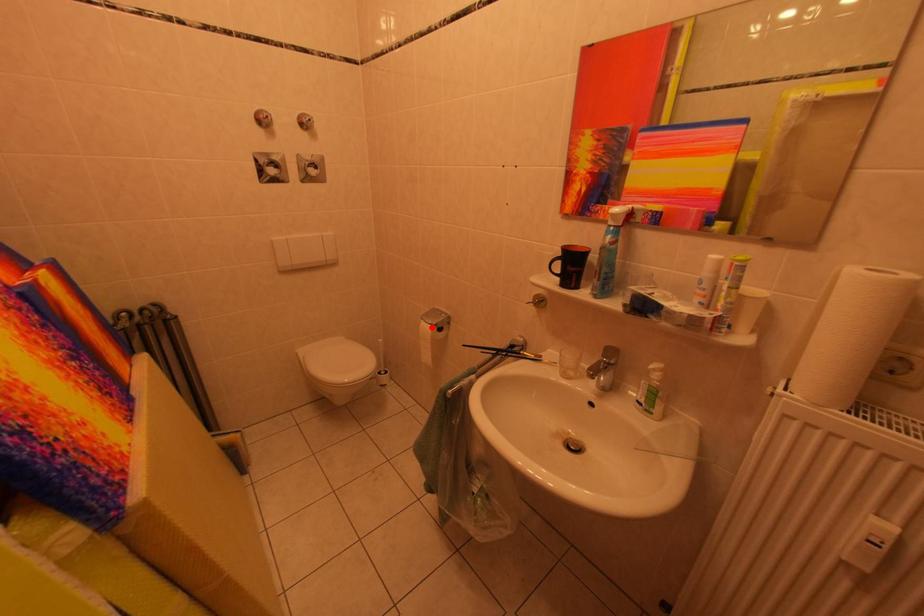
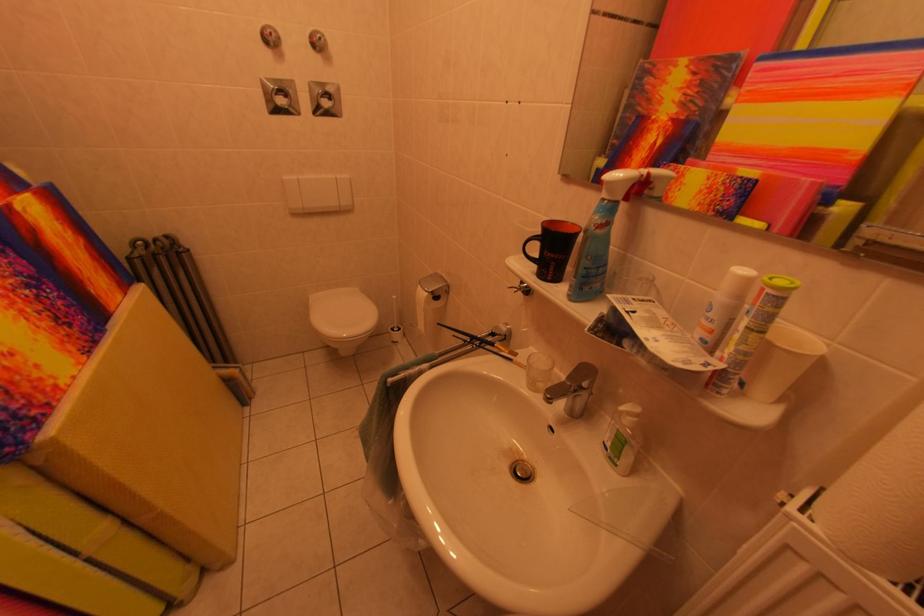
Find the pixel in the second image that matches the highlighted location in the first image.

(429, 292)